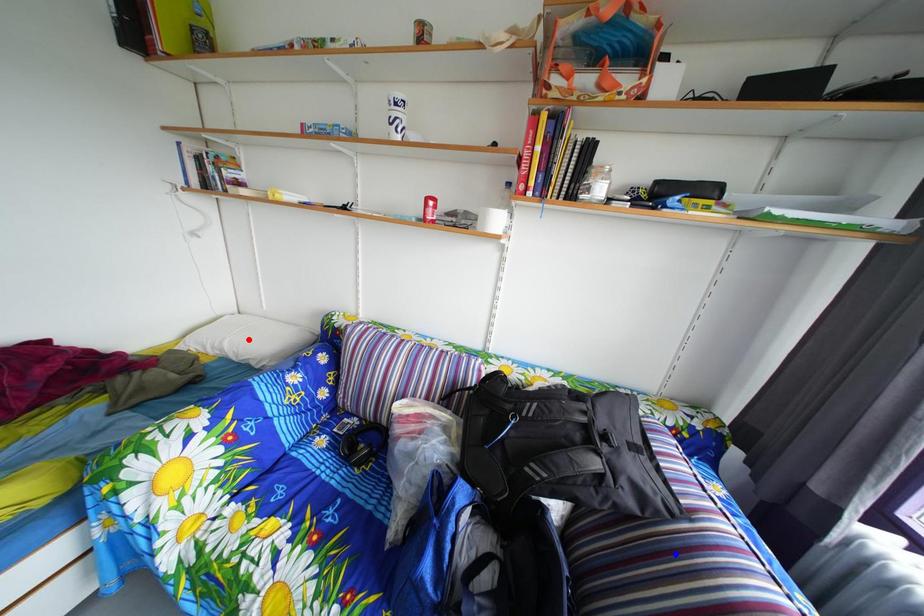
Question: Which of the two points in the image is closer to the camera?

Choices:
 (A) Blue point is closer.
 (B) Red point is closer.

Answer: (A)